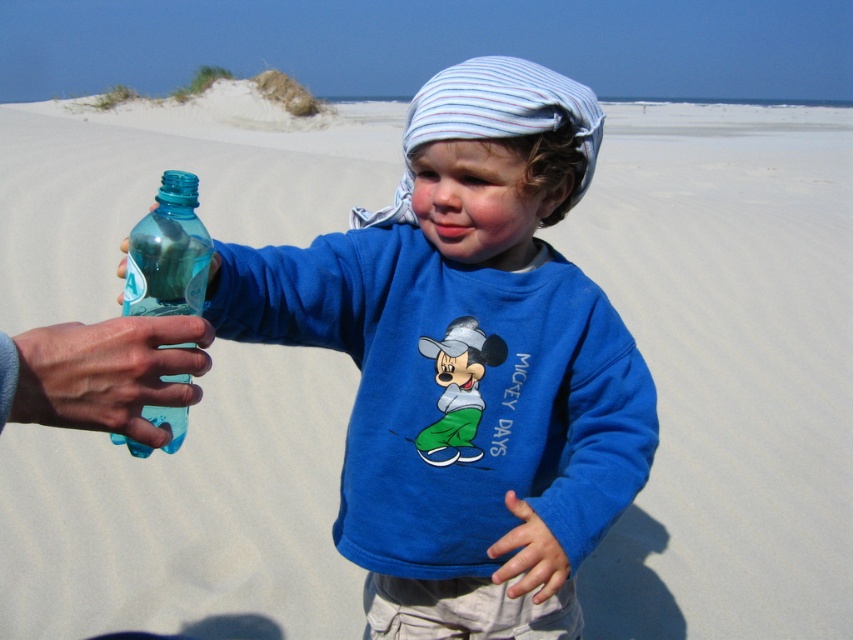
Question: Can you confirm if translucent plastic hand at lower left is positioned to the right of translucent plastic bottle at left?

Choices:
 (A) no
 (B) yes

Answer: (B)

Question: Can you confirm if translucent plastic hand at lower left is wider than smooth skin hand at lower center?

Choices:
 (A) yes
 (B) no

Answer: (B)

Question: Which is farther from the transparent plastic bottle at left?

Choices:
 (A) smooth skin hand at lower center
 (B) translucent plastic hand at lower left
 (C) translucent plastic bottle at left

Answer: (A)

Question: Can you confirm if translucent plastic hand at lower left is positioned below smooth skin hand at lower center?

Choices:
 (A) no
 (B) yes

Answer: (A)

Question: Which object is closer to the camera taking this photo?

Choices:
 (A) translucent plastic bottle at left
 (B) translucent plastic hand at lower left
 (C) smooth skin hand at lower center
 (D) transparent plastic bottle at left

Answer: (B)

Question: Which is farther from the transparent plastic bottle at left?

Choices:
 (A) translucent plastic bottle at left
 (B) translucent plastic hand at lower left

Answer: (B)